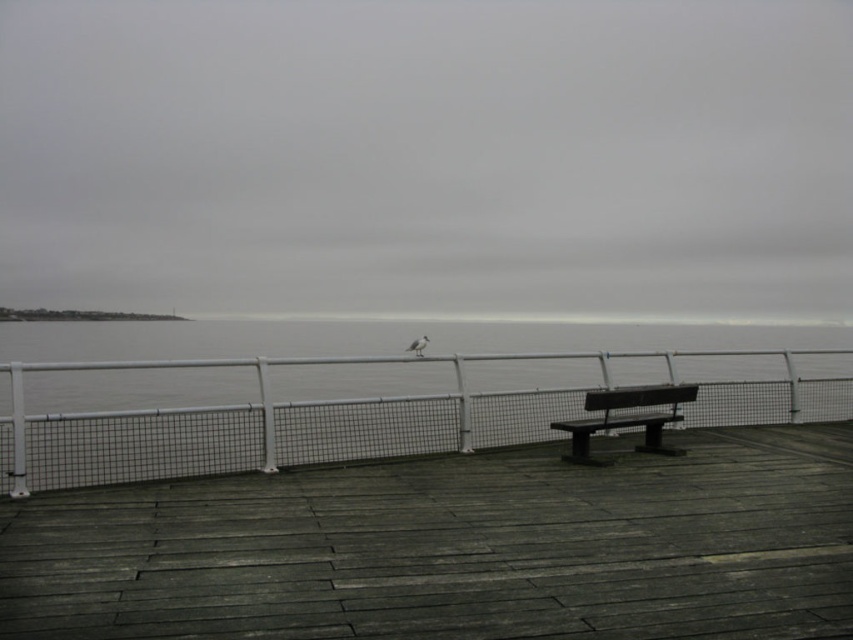
Can you confirm if gray cloudy sky at upper center is positioned to the right of white metal fence at center?

No, gray cloudy sky at upper center is not to the right of white metal fence at center.

Does point (488, 4) lie behind point (817, 381)?

Yes, point (488, 4) is farther from viewer.

Who is more distant from viewer, (775, 147) or (750, 417)?

The point (775, 147) is behind.

Identify the location of gray cloudy sky at upper center. The height and width of the screenshot is (640, 853). (428, 157).

In the scene shown: Does weathered wood deck at center appear on the right side of white metal fence at center?

In fact, weathered wood deck at center is to the left of white metal fence at center.

In the scene shown: Is weathered wood deck at center bigger than white metal fence at center?

Actually, weathered wood deck at center might be smaller than white metal fence at center.

Is point (751, 436) closer to camera compared to point (497, 397)?

No, it is not.

Identify the location of weathered wood deck at center. (454, 548).

Is point (131, 170) positioned in front of point (611, 392)?

No, it is behind (611, 392).

Which of these two, gray cloudy sky at upper center or dark brown wooden bench at center, stands taller?

gray cloudy sky at upper center is taller.

Identify the location of gray cloudy sky at upper center. (428, 157).

The height and width of the screenshot is (640, 853). What are the coordinates of `gray cloudy sky at upper center` in the screenshot? It's located at (428, 157).